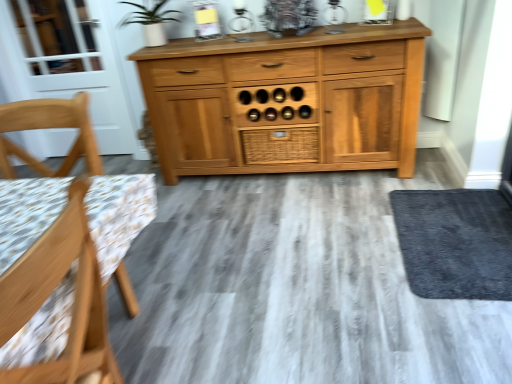
Where is `free spot above woven wood drawer at center (from a real-world perspective)`? The height and width of the screenshot is (384, 512). free spot above woven wood drawer at center (from a real-world perspective) is located at coordinates (285, 125).